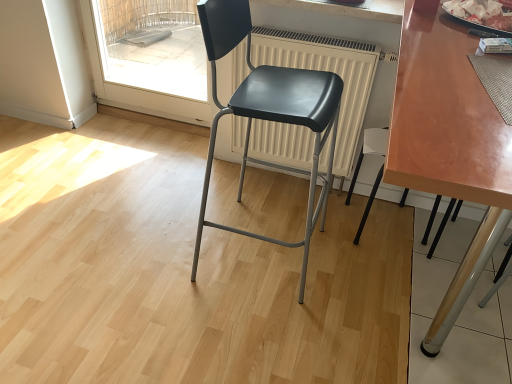
Where is `vacant area situated below matte black chair at center, which is the 1th chair in left-to-right order (from a real-world perspective)`? Image resolution: width=512 pixels, height=384 pixels. vacant area situated below matte black chair at center, which is the 1th chair in left-to-right order (from a real-world perspective) is located at coordinates (261, 252).